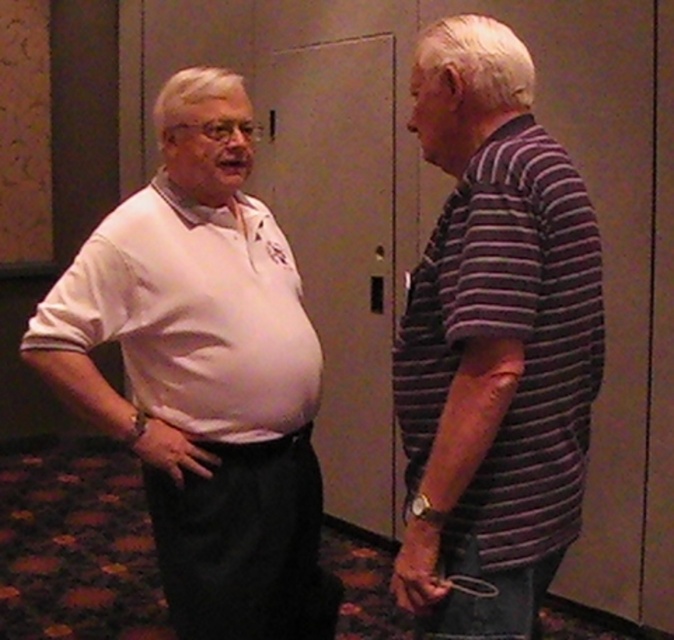
You are a photographer setting up a photo shoot in the room described. You notice two shirts available for the subject to wear during the shoot. The shirts are the white matte shirt at left and the white matte polo shirt at left. Based on their sizes, which shirt would you recommend if the subject prefers a longer length?

The white matte shirt at left has a greater height compared to the white matte polo shirt at left, so the white matte shirt at left would be the better choice for the subject who prefers a longer length.